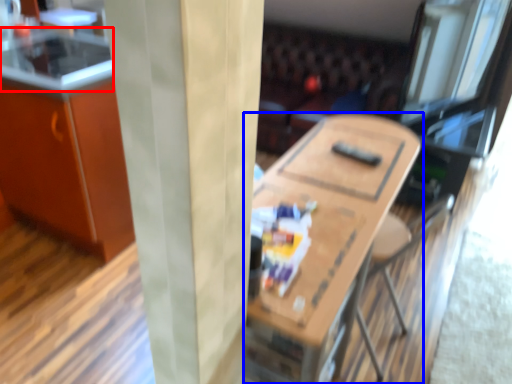
Question: Which object appears farthest to the camera in this image, counter top (highlighted by a red box) or table (highlighted by a blue box)?

Choices:
 (A) counter top
 (B) table

Answer: (A)